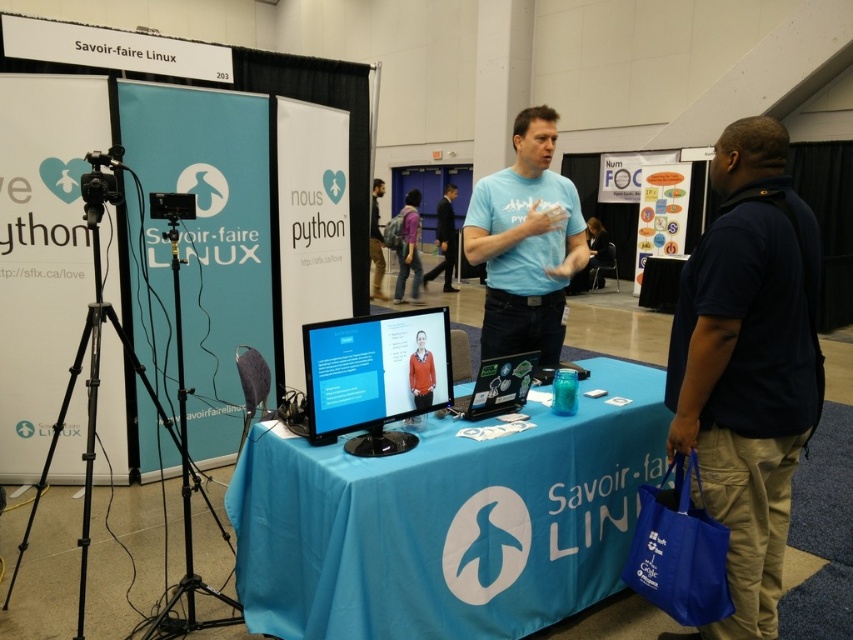
You are standing at the entrance of the conference hall and want to take a photo of the point at coordinates (599, 532). The camera you are using has a maximum focus range of 8 feet. Will the camera be able to focus on the point?

The distance of point (599, 532) from the camera is 8.09 feet, which is slightly beyond the camera maximum focus range of 8 feet. Therefore, the camera will not be able to focus on the point.